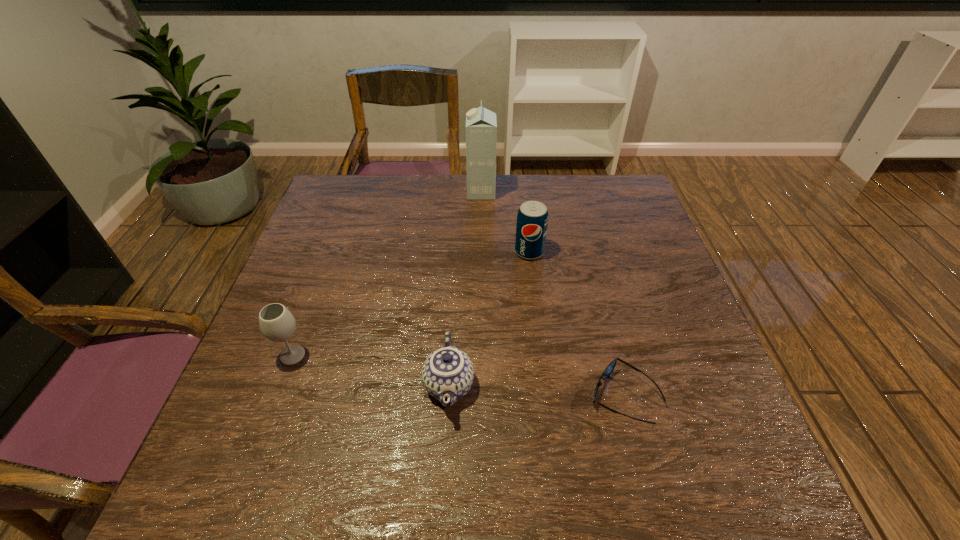
In the image, there is a desktop. Where is `free region at the far edge`? The height and width of the screenshot is (540, 960). free region at the far edge is located at coordinates click(444, 215).

In the image, there is a desktop. Identify the location of vacant space at the near edge. Image resolution: width=960 pixels, height=540 pixels. (611, 468).

This screenshot has width=960, height=540. In order to click on free location at the left edge in this screenshot , I will do `click(249, 437)`.

Find the location of `vacant space at the right edge of the desktop`. vacant space at the right edge of the desktop is located at coordinates (641, 346).

The image size is (960, 540). In the image, there is a desktop. Find the location of `vacant space at the far right corner`. vacant space at the far right corner is located at coordinates (613, 184).

Identify the location of free space at the near right corner. (734, 501).

Locate an element on the screen. The image size is (960, 540). blank region between the second shortest object and the carton is located at coordinates (465, 289).

Find the location of a particular element. vacant point located between the chinaware and the rightmost object is located at coordinates (537, 391).

Where is `vacant area that lies between the second shortest object and the leftmost object`? This screenshot has width=960, height=540. vacant area that lies between the second shortest object and the leftmost object is located at coordinates (371, 370).

Identify the location of free space between the chinaware and the rightmost object. The width and height of the screenshot is (960, 540). (537, 391).